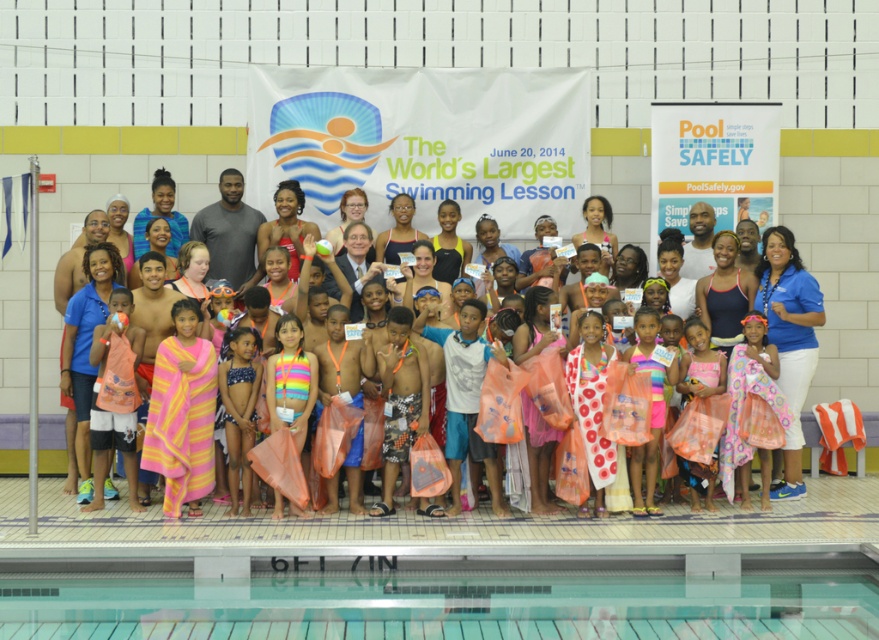
You are a photographer at the event and need to decide which item to fold first to save space. Which is larger, the multicolored towel at center or the multicolored fabric bikini at center?

The multicolored towel at center is bigger than the multicolored fabric bikini at center, so you should fold the multicolored towel at center first to save more space.

You are a photographer at the event and need to adjust the lighting to focus on both the multicolored towel at center and the multicolored fabric bikini at center. Which object is located to the right of the other?

The multicolored towel at center is positioned on the right side of multicolored fabric bikini at center.

You are a photographer taking a picture of the clear glass water at lower center and the multicolored fabric bikini at center. Which object should you focus on first if you want to ensure both are in focus?

The multicolored fabric bikini at center is taller than the clear glass water at lower center, so focusing on the multicolored fabric bikini at center first will help ensure both are in focus.